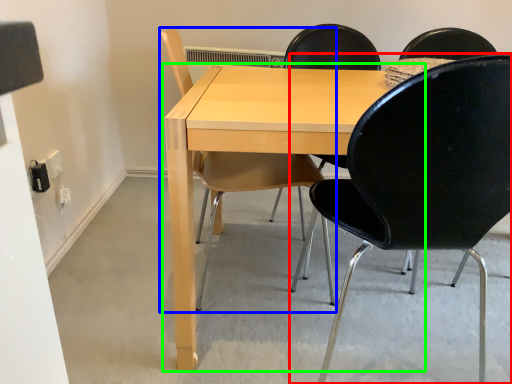
Question: Estimate the real-world distances between objects in this image. Which object is closer to chair (highlighted by a red box), chair (highlighted by a blue box) or table (highlighted by a green box)?

Choices:
 (A) chair
 (B) table

Answer: (B)